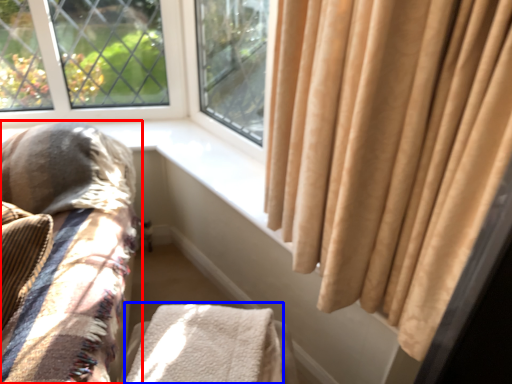
Question: Which object is further to the camera taking this photo, furniture (highlighted by a red box) or blanket (highlighted by a blue box)?

Choices:
 (A) furniture
 (B) blanket

Answer: (B)